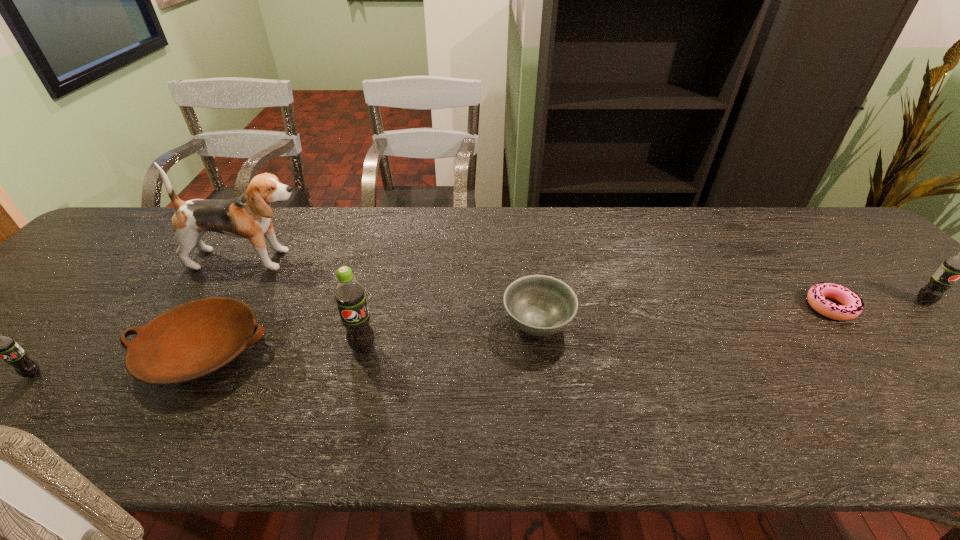
Please point a space for a new pop_(soda) to maintain equal intervals. Please provide its 2D coordinates. Your answer should be formatted as a tuple, i.e. [(x, y)], where the tuple contains the x and y coordinates of a point satisfying the conditions above.

[(659, 323)]